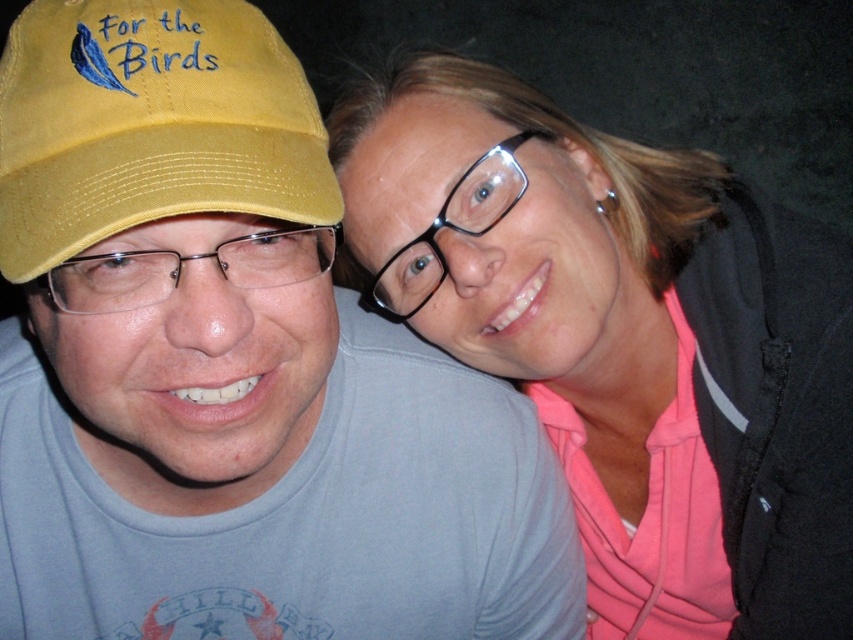
Question: Can you confirm if matte yellow cap at left is bigger than yellow fabric cap at left?

Choices:
 (A) no
 (B) yes

Answer: (B)

Question: Can you confirm if matte yellow cap at left is wider than pink fabric at upper right?

Choices:
 (A) yes
 (B) no

Answer: (A)

Question: Which of the following is the farthest from the observer?

Choices:
 (A) (515, 291)
 (B) (337, 221)

Answer: (A)

Question: Which is farther from the matte yellow cap at left?

Choices:
 (A) pink fabric at upper right
 (B) yellow fabric cap at left

Answer: (A)

Question: Which point is closer to the camera?

Choices:
 (A) pink fabric at upper right
 (B) yellow fabric cap at left
 (C) matte yellow cap at left

Answer: (B)

Question: Can you confirm if matte yellow cap at left is positioned to the left of yellow fabric cap at left?

Choices:
 (A) no
 (B) yes

Answer: (B)